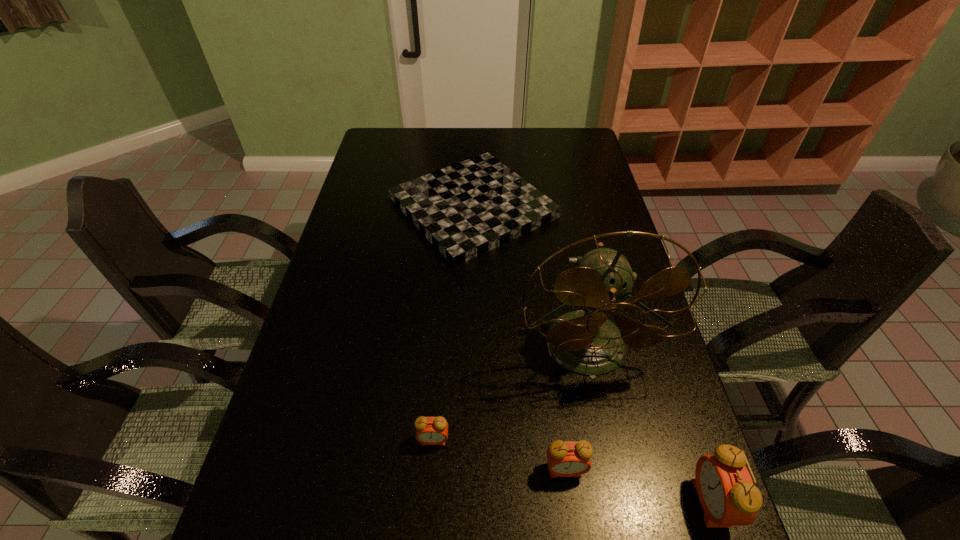
Please point a spot to add another alarm clock on the left. Please provide its 2D coordinates. Your answer should be formatted as a tuple, i.e. [(x, y)], where the tuple contains the x and y coordinates of a point satisfying the conditions above.

[(313, 413)]